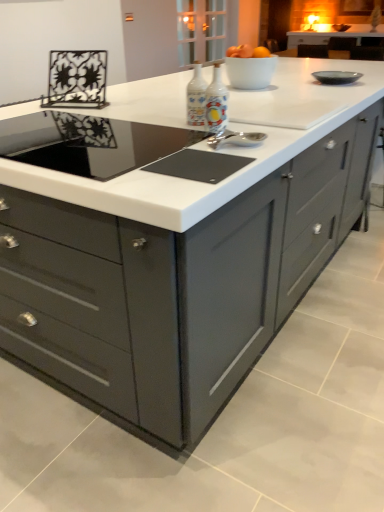
Question: In which direction should I rotate to look at porcelain bottles at center, positioned as the first appliance in right-to-left order?

Choices:
 (A) right
 (B) left

Answer: (A)

Question: From the image's perspective, is matte glass bottles at center, positioned as the first appliance in left-to-right order, located beneath black glass cooktop at center?

Choices:
 (A) yes
 (B) no

Answer: (B)

Question: Considering the relative sizes of matte glass bottles at center, the 2th appliance when ordered from right to left, and black glass cooktop at center in the image provided, is matte glass bottles at center, the 2th appliance when ordered from right to left, shorter than black glass cooktop at center?

Choices:
 (A) no
 (B) yes

Answer: (A)

Question: Is black glass cooktop at center at the back of matte glass bottles at center, the 2th appliance when ordered from right to left?

Choices:
 (A) yes
 (B) no

Answer: (B)

Question: From the image's perspective, is matte glass bottles at center, the 2th appliance when ordered from right to left, on black glass cooktop at center?

Choices:
 (A) no
 (B) yes

Answer: (B)

Question: Is matte glass bottles at center, positioned as the first appliance in left-to-right order, wider than black glass cooktop at center?

Choices:
 (A) yes
 (B) no

Answer: (B)

Question: Is matte glass bottles at center, the 2th appliance when ordered from right to left, thinner than black glass cooktop at center?

Choices:
 (A) no
 (B) yes

Answer: (B)

Question: Can you confirm if matte gray cabinet at right is taller than matte glass bottles at center, positioned as the first appliance in left-to-right order?

Choices:
 (A) no
 (B) yes

Answer: (B)

Question: Can you confirm if matte gray cabinet at right is positioned to the right of matte glass bottles at center, the 2th appliance when ordered from right to left?

Choices:
 (A) yes
 (B) no

Answer: (A)

Question: Is matte gray cabinet at right smaller than matte glass bottles at center, positioned as the first appliance in left-to-right order?

Choices:
 (A) yes
 (B) no

Answer: (B)

Question: Is matte gray cabinet at right not close to matte glass bottles at center, the 2th appliance when ordered from right to left?

Choices:
 (A) no
 (B) yes

Answer: (B)

Question: Is matte gray cabinet at right thinner than matte glass bottles at center, the 2th appliance when ordered from right to left?

Choices:
 (A) yes
 (B) no

Answer: (B)

Question: Does matte gray cabinet at right contain matte glass bottles at center, positioned as the first appliance in left-to-right order?

Choices:
 (A) yes
 (B) no

Answer: (B)

Question: Is porcelain bottles at center, which is the second appliance from left to right, wider than black glass cooktop at center?

Choices:
 (A) no
 (B) yes

Answer: (A)